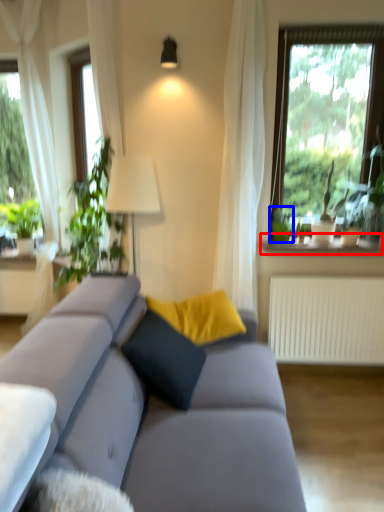
Question: Which of the following is the farthest to the observer, window sill (highlighted by a red box) or plant (highlighted by a blue box)?

Choices:
 (A) window sill
 (B) plant

Answer: (B)